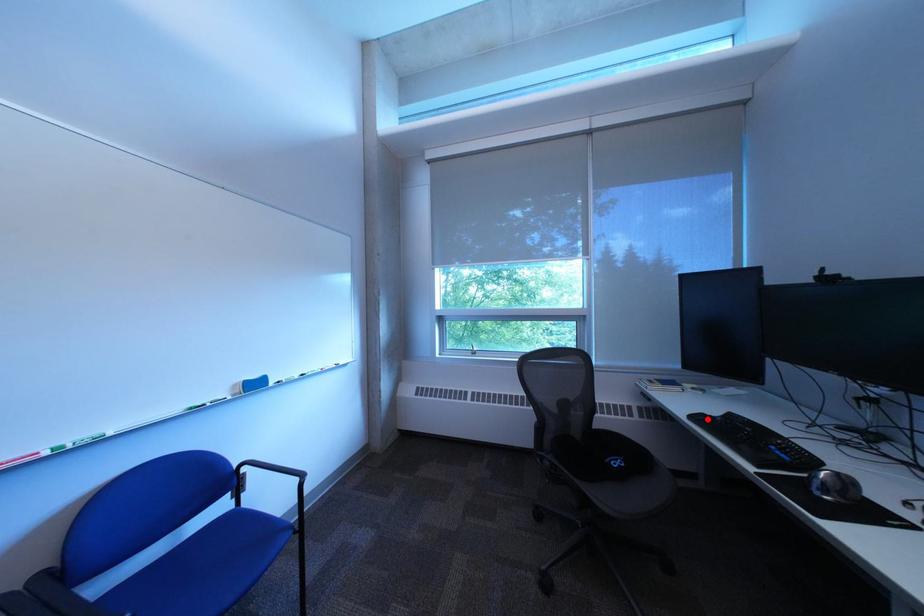
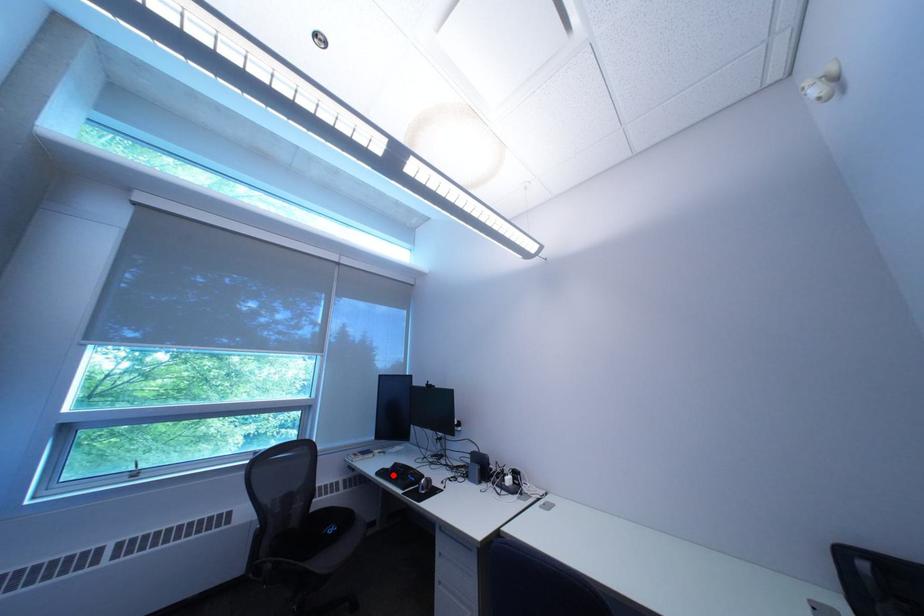
I am providing you with two images of the same scene from different viewpoints. A red point is marked on the first image and another point is marked on the second image. Does the point marked in image1 correspond to the same location as the one in image2?

Yes